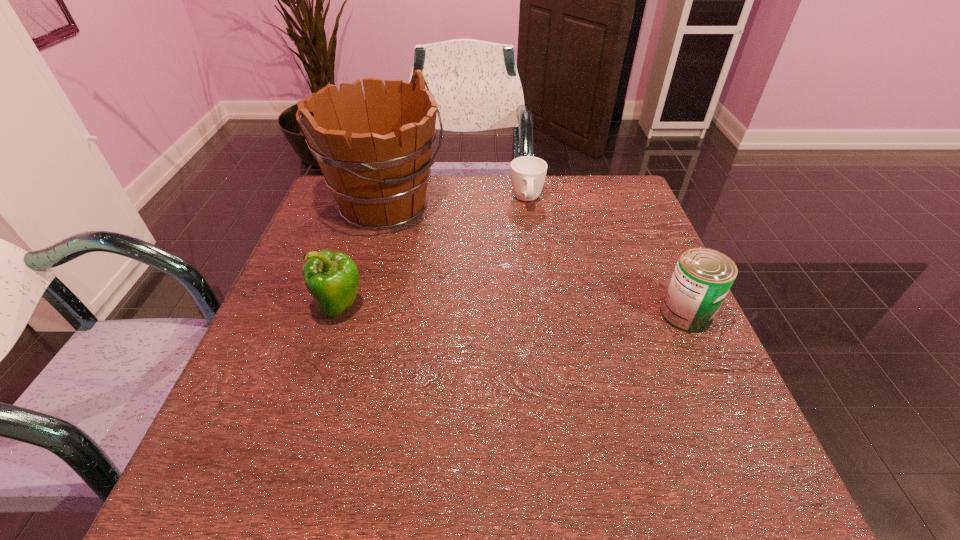
Where is `free space that satisfies the following two spatial constraints: 1. on the front side of the can; 2. on the left side of the tallest object`? free space that satisfies the following two spatial constraints: 1. on the front side of the can; 2. on the left side of the tallest object is located at coordinates (356, 314).

Identify the location of free region that satisfies the following two spatial constraints: 1. on the back side of the tallest object; 2. on the right side of the cup. click(387, 201).